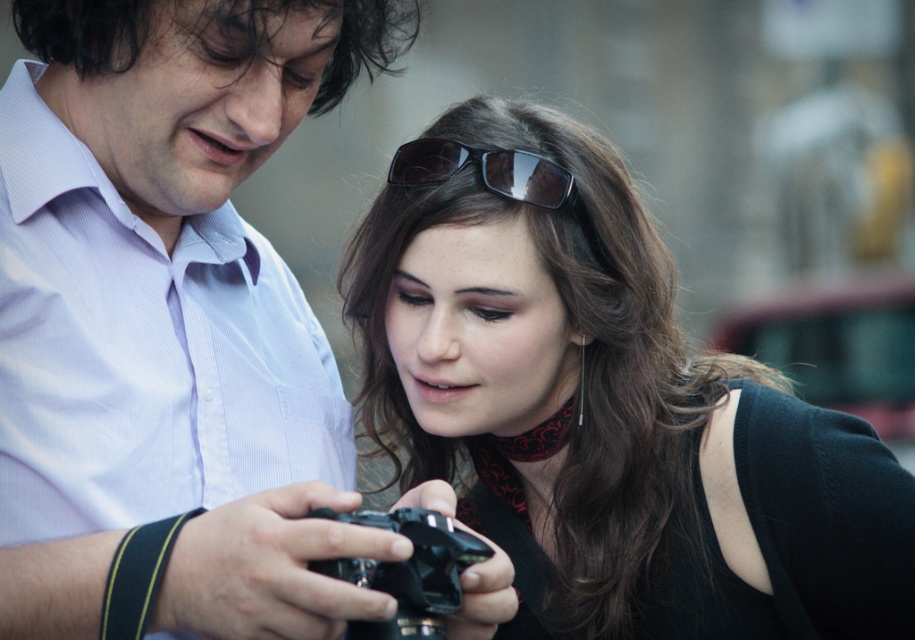
You are a photographer trying to locate your matte black camera at center in the image. According to the coordinates provided, where should you look to find it?

The matte black camera at center is located at coordinates point (605,404).

Consider the image. You are a photographer trying to decide whether to place a new matte black camera at center on a shelf that can only hold items narrower than the matte black hair at upper left. Can the camera fit on the shelf?

The matte black camera at center has a width less than the matte black hair at upper left, so it can fit on the shelf.

You are a photographer trying to choose between the matte black camera at center and the black plastic camera at center based on their height. Which one is taller?

The matte black camera at center is taller than the black plastic camera at center.